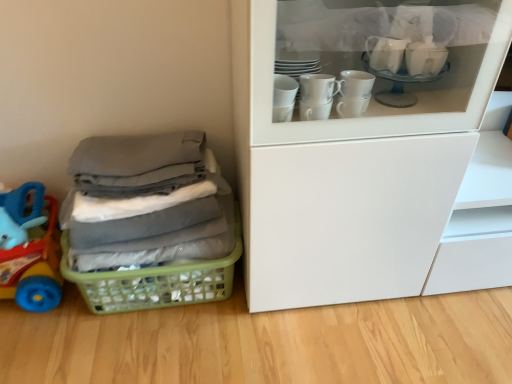
Question: From the image's perspective, would you say green plastic basket at lower left is positioned over rubberized blue toy at left?

Choices:
 (A) no
 (B) yes

Answer: (A)

Question: Can you confirm if green plastic basket at lower left is thinner than rubberized blue toy at left?

Choices:
 (A) yes
 (B) no

Answer: (B)

Question: Is green plastic basket at lower left far away from rubberized blue toy at left?

Choices:
 (A) yes
 (B) no

Answer: (B)

Question: Can you confirm if green plastic basket at lower left is shorter than rubberized blue toy at left?

Choices:
 (A) yes
 (B) no

Answer: (A)

Question: Is green plastic basket at lower left oriented towards rubberized blue toy at left?

Choices:
 (A) no
 (B) yes

Answer: (A)

Question: Is green plastic basket at lower left beside rubberized blue toy at left?

Choices:
 (A) yes
 (B) no

Answer: (B)

Question: From the image's perspective, is gray fabric at left above rubberized blue toy at left?

Choices:
 (A) yes
 (B) no

Answer: (A)

Question: Is gray fabric at left outside rubberized blue toy at left?

Choices:
 (A) yes
 (B) no

Answer: (A)

Question: Can you confirm if gray fabric at left is bigger than rubberized blue toy at left?

Choices:
 (A) yes
 (B) no

Answer: (A)

Question: Is gray fabric at left touching rubberized blue toy at left?

Choices:
 (A) no
 (B) yes

Answer: (A)

Question: Is gray fabric at left closer to camera compared to rubberized blue toy at left?

Choices:
 (A) yes
 (B) no

Answer: (A)

Question: Is gray fabric at left aimed at rubberized blue toy at left?

Choices:
 (A) yes
 (B) no

Answer: (B)

Question: From a real-world perspective, does gray fabric at left sit lower than green plastic basket at lower left?

Choices:
 (A) no
 (B) yes

Answer: (A)